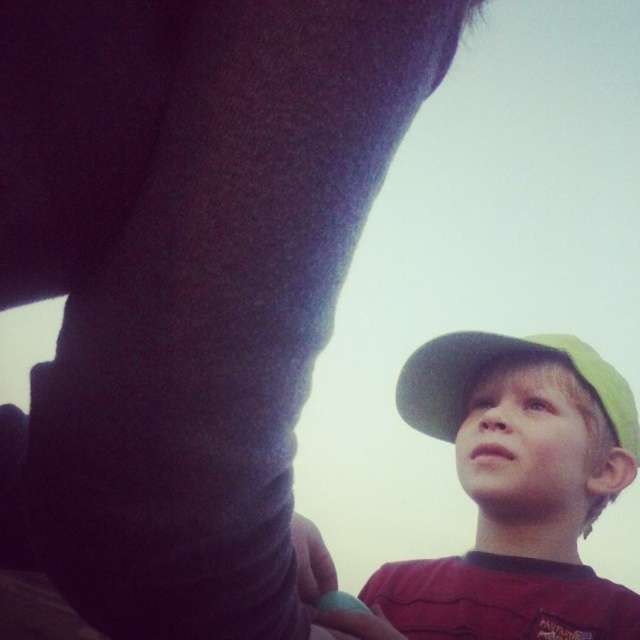
You are a photographer trying to capture a closeup shot of the matte green cap at lower right. Based on the scene description, what is the minimum distance you need to be from the cap to ensure it fills the frame properly?

The minimum distance you need to be from the matte green cap at lower right is 74.74 centimeters to ensure it fills the frame properly.

You are a photographer adjusting the camera angle to focus on the matte green cap at lower right and the green fabric baseball hat at lower right. Which object should you adjust the focus on first if you want to capture the taller one?

The matte green cap at lower right is much taller than the green fabric baseball hat at lower right, so you should focus on the matte green cap at lower right first.